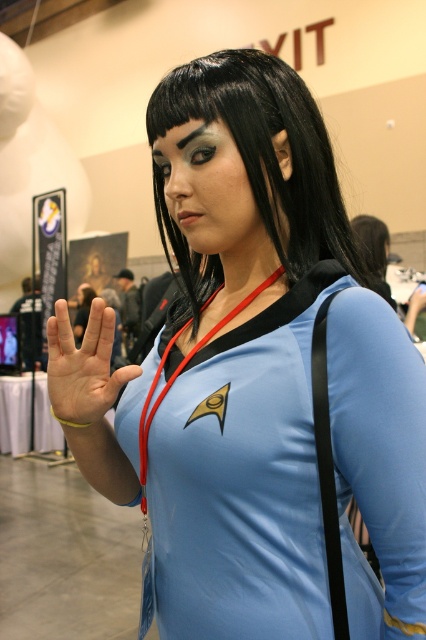
Which is below, black smooth hair at center or light skin palm at center?

light skin palm at center is lower down.

Where is `black smooth hair at center`? The image size is (426, 640). black smooth hair at center is located at coordinates (267, 148).

Locate an element on the screen. Image resolution: width=426 pixels, height=640 pixels. black smooth hair at center is located at coordinates (267, 148).